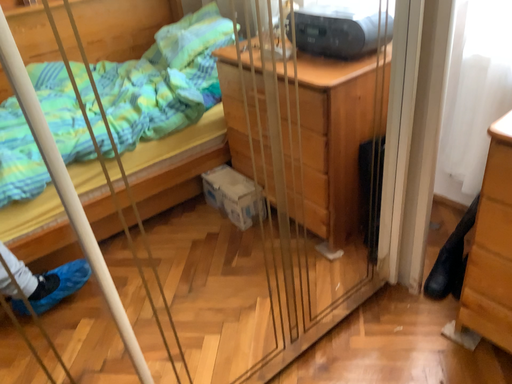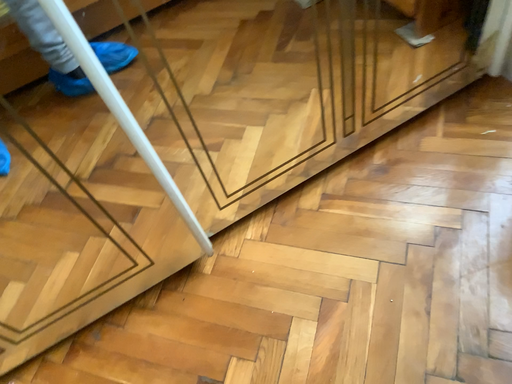
Question: How did the camera likely rotate when shooting the video?

Choices:
 (A) rotated downward
 (B) rotated upward

Answer: (A)